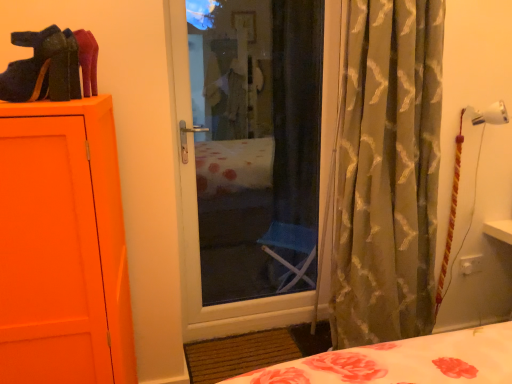
Question: Is the surface of silky green curtain at right in direct contact with velvet-like black shoe at upper left?

Choices:
 (A) yes
 (B) no

Answer: (B)

Question: From a real-world perspective, is silky green curtain at right physically below velvet-like black shoe at upper left?

Choices:
 (A) yes
 (B) no

Answer: (A)

Question: Does silky green curtain at right have a lesser height compared to velvet-like black shoe at upper left?

Choices:
 (A) no
 (B) yes

Answer: (A)

Question: From the image's perspective, does silky green curtain at right appear lower than velvet-like black shoe at upper left?

Choices:
 (A) no
 (B) yes

Answer: (B)

Question: Could you tell me if silky green curtain at right is facing velvet-like black shoe at upper left?

Choices:
 (A) yes
 (B) no

Answer: (B)

Question: Is silky green curtain at right bigger than velvet-like black shoe at upper left?

Choices:
 (A) no
 (B) yes

Answer: (B)

Question: Considering the relative sizes of velvet-like black shoe at upper left and silky green curtain at right in the image provided, is velvet-like black shoe at upper left wider than silky green curtain at right?

Choices:
 (A) yes
 (B) no

Answer: (B)

Question: From a real-world perspective, is velvet-like black shoe at upper left physically below silky green curtain at right?

Choices:
 (A) yes
 (B) no

Answer: (B)

Question: Is the depth of velvet-like black shoe at upper left less than that of silky green curtain at right?

Choices:
 (A) yes
 (B) no

Answer: (A)

Question: Is velvet-like black shoe at upper left aimed at silky green curtain at right?

Choices:
 (A) no
 (B) yes

Answer: (B)

Question: From a real-world perspective, does velvet-like black shoe at upper left stand above silky green curtain at right?

Choices:
 (A) yes
 (B) no

Answer: (A)

Question: Does velvet-like black shoe at upper left touch silky green curtain at right?

Choices:
 (A) yes
 (B) no

Answer: (B)

Question: From a real-world perspective, is velvet-like black shoe at upper left positioned above or below silky green curtain at right?

Choices:
 (A) below
 (B) above

Answer: (B)